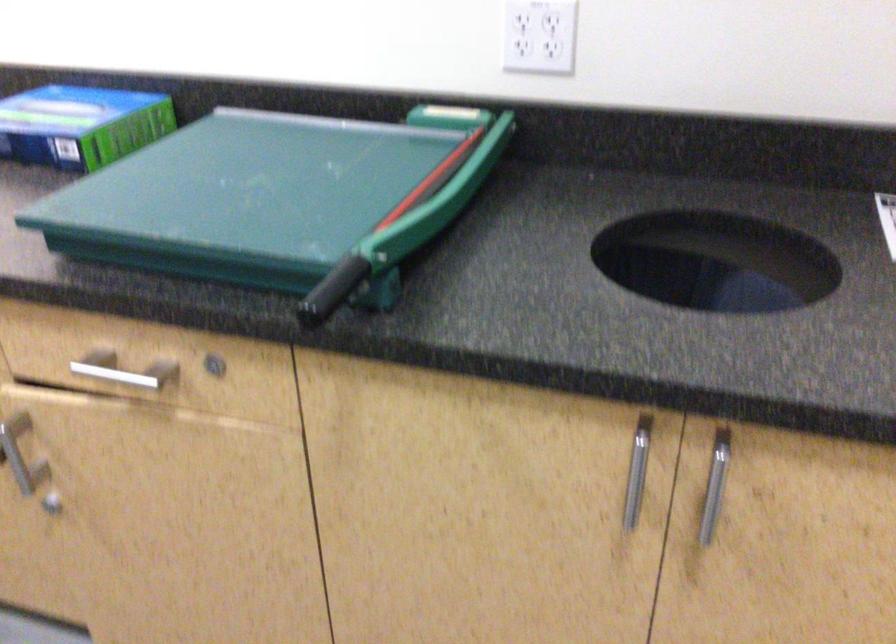
Locate an element on the screen. The width and height of the screenshot is (896, 644). black cutter handle is located at coordinates (332, 290).